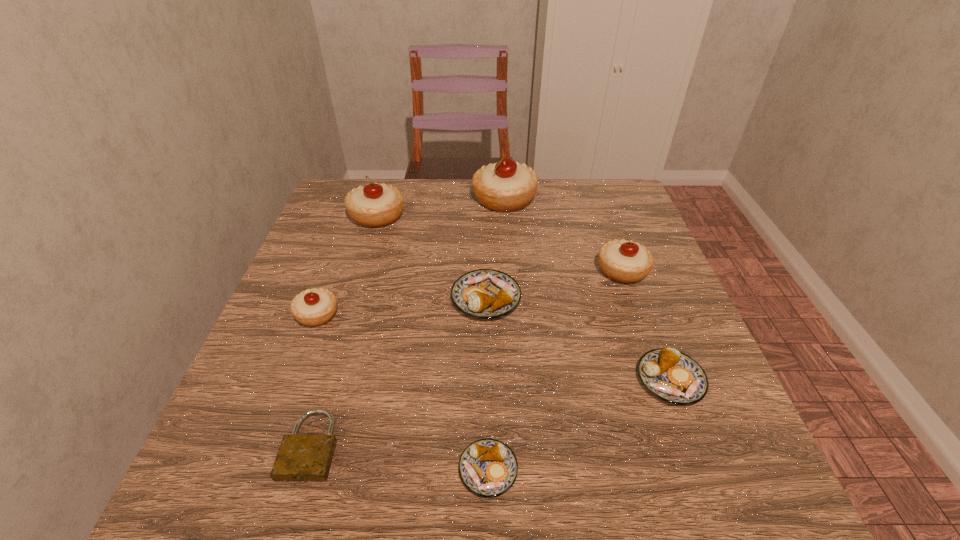
Where is `the sixth tallest pastry`? The height and width of the screenshot is (540, 960). the sixth tallest pastry is located at coordinates (672, 376).

In order to click on the third nearest object in this screenshot , I will do `click(672, 376)`.

Find the location of a particular element. The width and height of the screenshot is (960, 540). the nearest brown pastry is located at coordinates (488, 468).

I want to click on the smallest brown pastry, so click(488, 468).

You are a GUI agent. You are given a task and a screenshot of the screen. Output one action in this format:
    pyautogui.click(x=<x>, y=<y>)
    Task: Click on the shortest object
    This screenshot has width=960, height=540.
    Given the screenshot: What is the action you would take?
    pyautogui.click(x=301, y=457)

Where is `vacant area situated on the left of the biggest beige pastry`? vacant area situated on the left of the biggest beige pastry is located at coordinates (429, 199).

In order to click on vacant area situated 0.120m on the front of the second tallest object in this screenshot , I will do `click(363, 262)`.

You are a GUI agent. You are given a task and a screenshot of the screen. Output one action in this format:
    pyautogui.click(x=<x>, y=<y>)
    Task: Click on the vacant space located on the left of the third farthest beige pastry
    
    Given the screenshot: What is the action you would take?
    pyautogui.click(x=479, y=270)

At what (x,y) coordinates should I click in order to perform the action: click on free location located on the back of the nearest beige pastry. Please return your answer as a coordinate pair (x, y). Looking at the image, I should click on (333, 272).

This screenshot has height=540, width=960. Identify the location of free space located on the back of the biggest brown pastry. (485, 240).